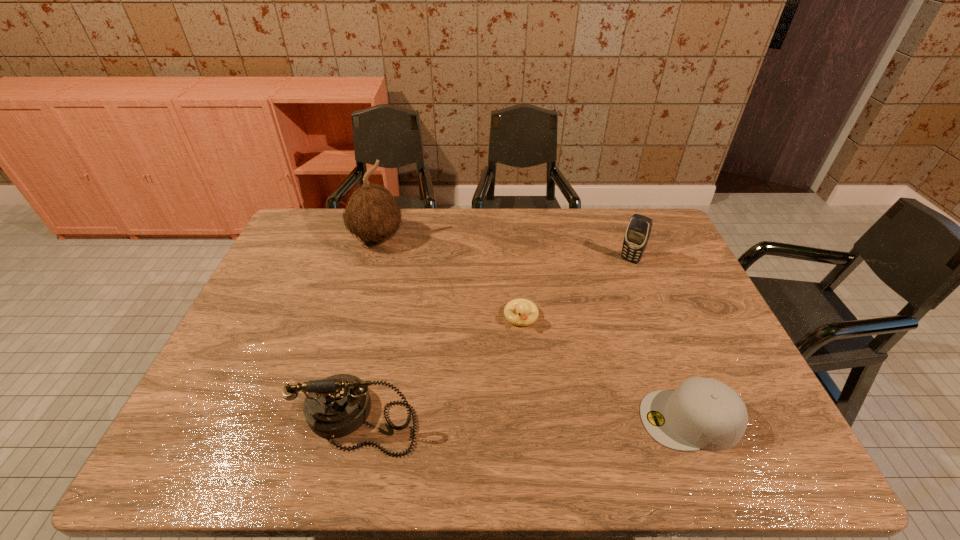
The height and width of the screenshot is (540, 960). In order to click on telephone in this screenshot , I will do `click(338, 405)`.

This screenshot has width=960, height=540. Find the location of `cap`. cap is located at coordinates (702, 413).

I want to click on the third farthest object, so click(x=527, y=312).

The height and width of the screenshot is (540, 960). What are the coordinates of `the third object from left to right` in the screenshot? It's located at (527, 312).

Locate an element on the screen. the tallest object is located at coordinates (371, 213).

Identify the location of cellular telephone. (637, 234).

The height and width of the screenshot is (540, 960). What are the coordinates of `blank space located 0.400m on the back of the telephone` in the screenshot? It's located at (392, 275).

This screenshot has height=540, width=960. In order to click on vacant space located on the front-facing side of the cap in this screenshot , I will do `click(563, 420)`.

This screenshot has height=540, width=960. In order to click on vacant area situated on the front-facing side of the cap in this screenshot , I will do `click(576, 420)`.

What are the coordinates of `free space located 0.080m on the front-facing side of the cap` in the screenshot? It's located at (607, 420).